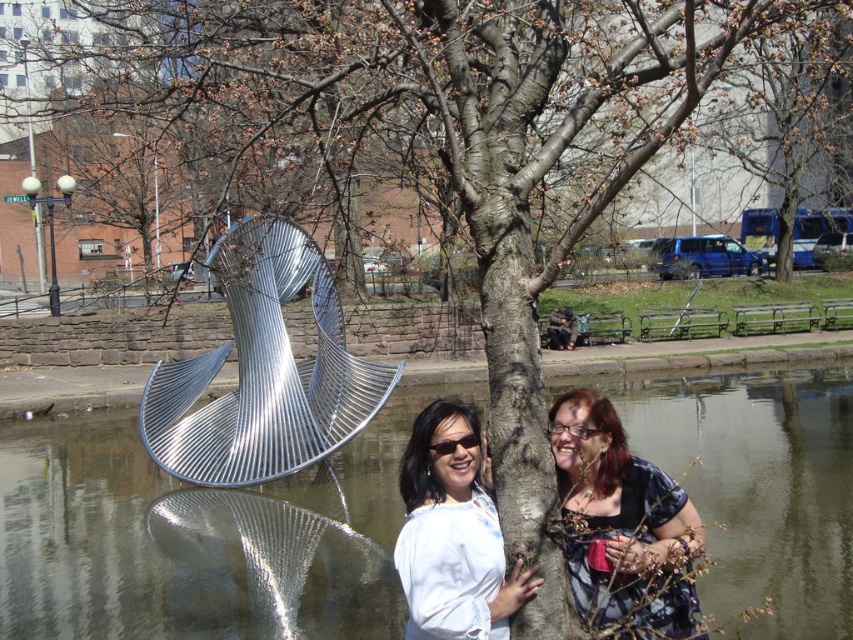
You are standing at the point marked as point (114, 541) in the image. Based on the scene description, what type of surface are you most likely standing on?

The point (114, 541) is on metallic water at center, so you are most likely standing on metallic water.

You are standing at the point with coordinates point (622, 525). What object are you currently standing on?

You are standing on the patterned fabric dress at center.